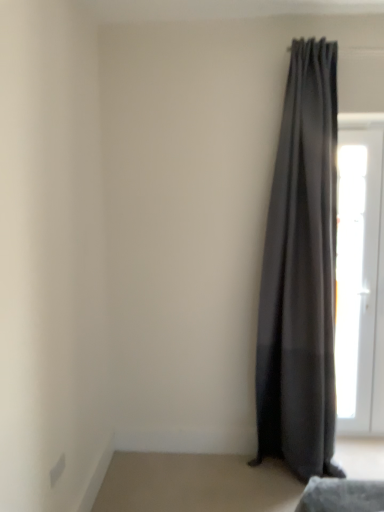
Question: Would you say white glossy door at right is to the left or to the right of dark gray sheer curtain at right in the picture?

Choices:
 (A) left
 (B) right

Answer: (B)

Question: Looking at the image, does white glossy door at right seem bigger or smaller compared to dark gray sheer curtain at right?

Choices:
 (A) big
 (B) small

Answer: (B)

Question: Is point (340, 179) positioned closer to the camera than point (261, 334)?

Choices:
 (A) closer
 (B) farther

Answer: (B)

Question: From the image's perspective, is dark gray sheer curtain at right positioned above or below white glossy door at right?

Choices:
 (A) below
 (B) above

Answer: (B)

Question: Looking at their shapes, would you say dark gray sheer curtain at right is wider or thinner than white glossy door at right?

Choices:
 (A) wide
 (B) thin

Answer: (A)

Question: Is dark gray sheer curtain at right to the left or to the right of white glossy door at right in the image?

Choices:
 (A) left
 (B) right

Answer: (A)

Question: Considering the positions of point (332, 355) and point (375, 228), is point (332, 355) closer or farther from the camera than point (375, 228)?

Choices:
 (A) closer
 (B) farther

Answer: (A)